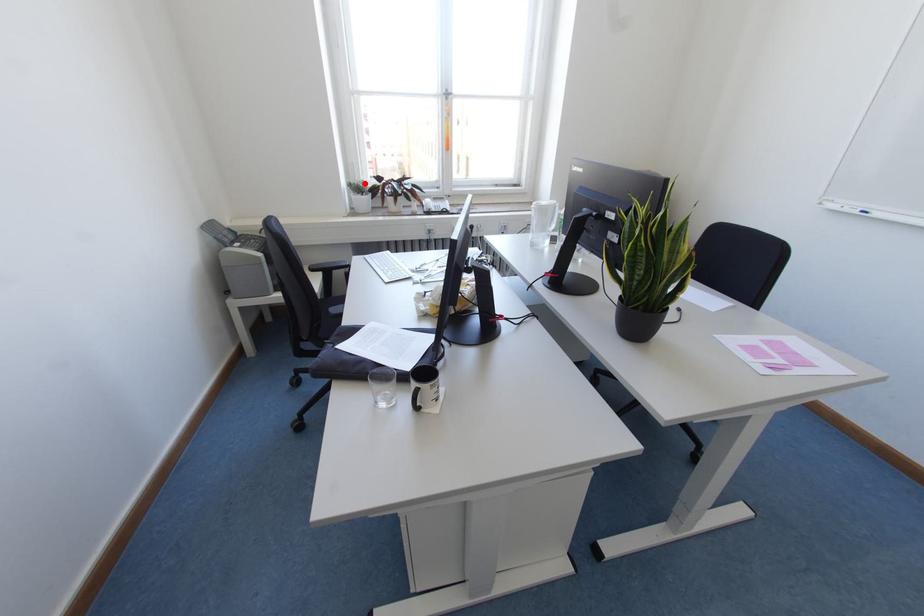
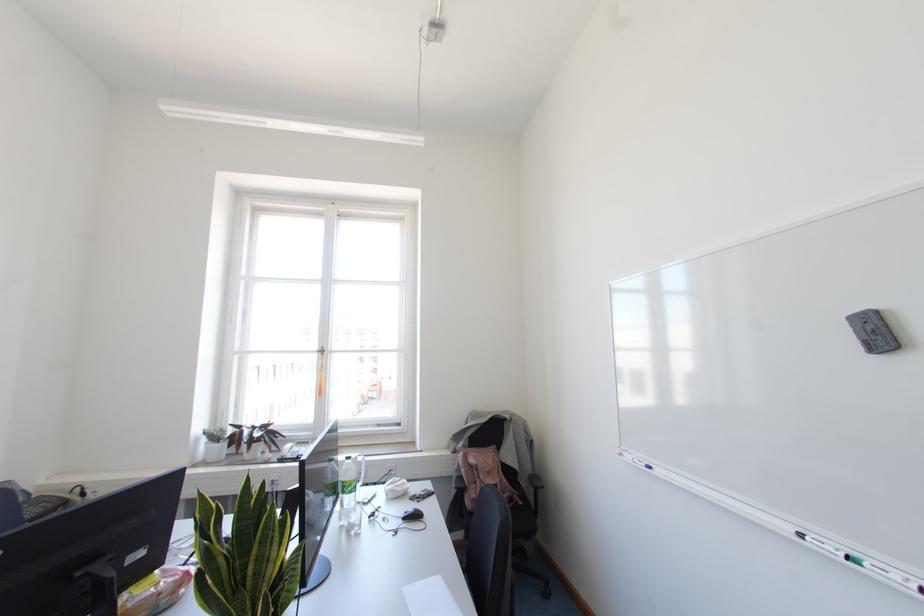
In the second image, find the point that corresponds to the highlighted location in the first image.

(223, 431)